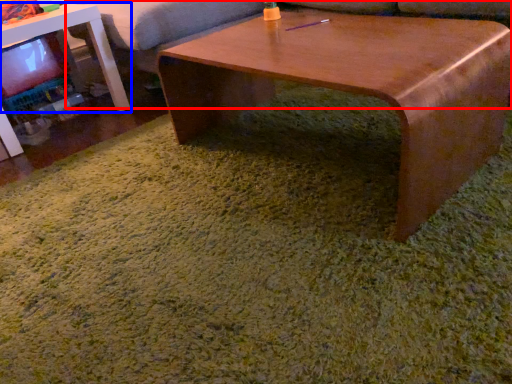
Question: Which of the following is the farthest to the observer, couch (highlighted by a red box) or table (highlighted by a blue box)?

Choices:
 (A) couch
 (B) table

Answer: (A)